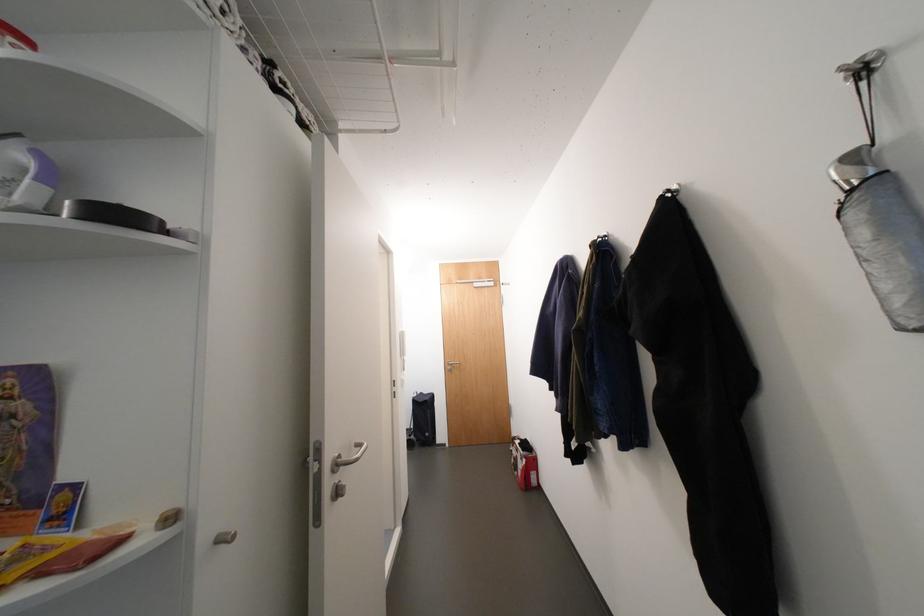
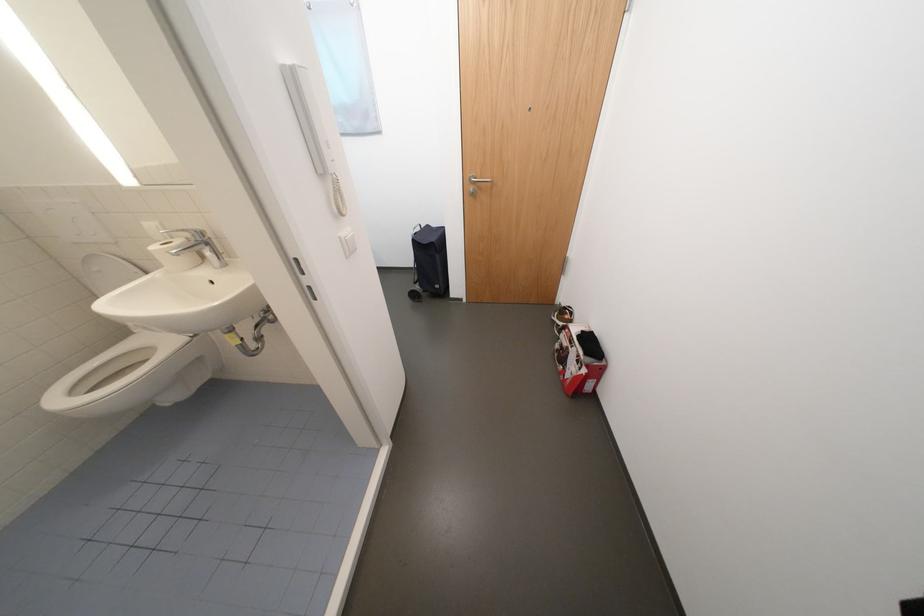
Where in the second image is the point corresponding to pixel 456 363 from the first image?

(478, 180)